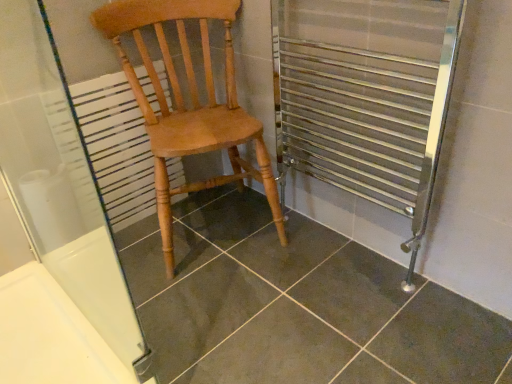
This screenshot has height=384, width=512. In order to click on vacant space to the right of white textured radiator at left in this screenshot , I will do `click(202, 216)`.